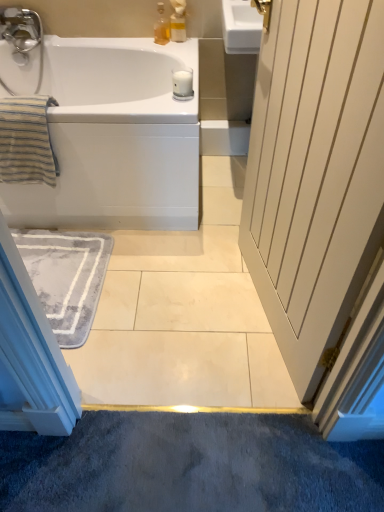
Identify the location of blank space to the left of translucent plastic soap dispenser at upper center. This screenshot has width=384, height=512. (151, 42).